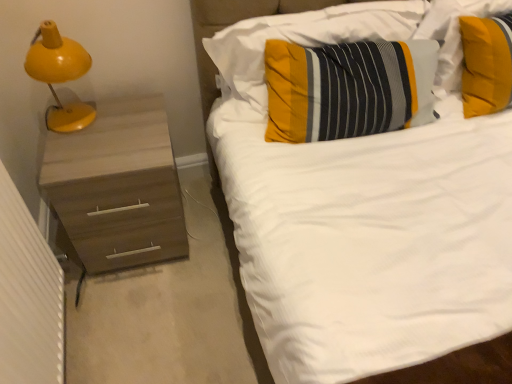
Find the location of a particular element. free space above matte wood chest of drawers at left (from a real-world perspective) is located at coordinates point(95,139).